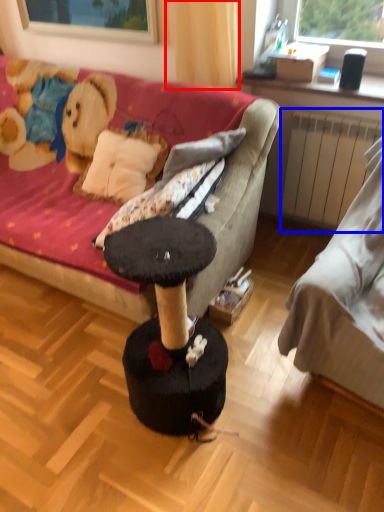
Question: Which of the following is the closest to the observer, curtain (highlighted by a red box) or radiator (highlighted by a blue box)?

Choices:
 (A) curtain
 (B) radiator

Answer: (A)